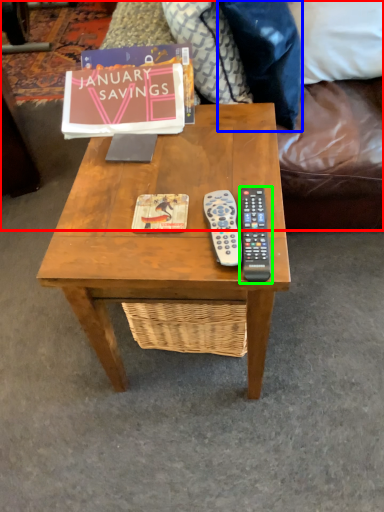
Question: Which object is the farthest from studio couch (highlighted by a red box)? Choose among these: pillow (highlighted by a blue box) or remote control (highlighted by a green box).

Choices:
 (A) pillow
 (B) remote control

Answer: (B)